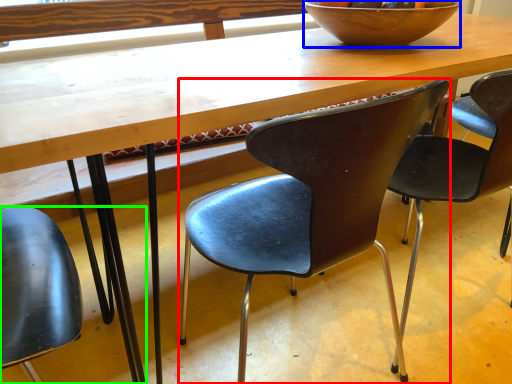
Question: Estimate the real-world distances between objects in this image. Which object is closer to chair (highlighted by a red box), bowl (highlighted by a blue box) or chair (highlighted by a green box)?

Choices:
 (A) bowl
 (B) chair

Answer: (A)